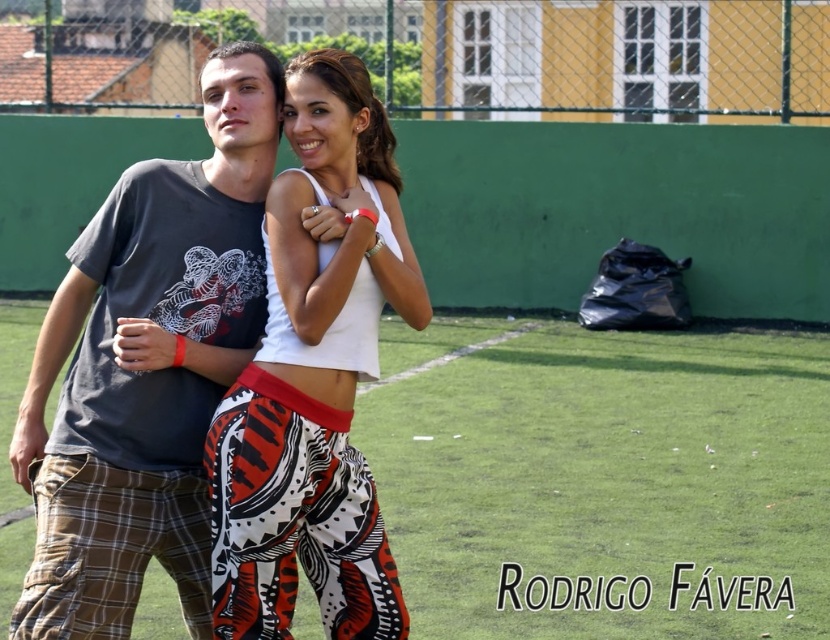
Find the location of a particular element. The width and height of the screenshot is (830, 640). dark gray t-shirt at center is located at coordinates (147, 368).

Describe the element at coordinates (147, 368) in the screenshot. I see `dark gray t-shirt at center` at that location.

Identify the location of dark gray t-shirt at center. This screenshot has height=640, width=830. (147, 368).